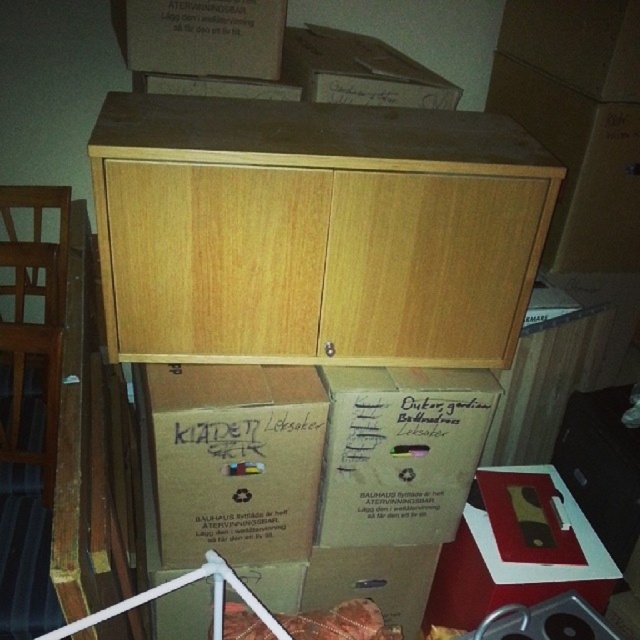
You are trying to move the matte cardboard box at lower right to the left side of the light wood cabinet at upper center. Is there enough space between the cabinet and the wall to slide the box in without removing the cabinet?

The light wood cabinet at upper center might be wider than matte cardboard box at lower right, so it is uncertain if there is enough space to slide the box in without moving the cabinet. Check the actual dimensions before attempting.

You are organizing a storage room and see the brown cardboard box at center and the matte cardboard box at lower right. Which box is closer to you?

The brown cardboard box at center is closer to you because it is in front of the matte cardboard box at lower right.